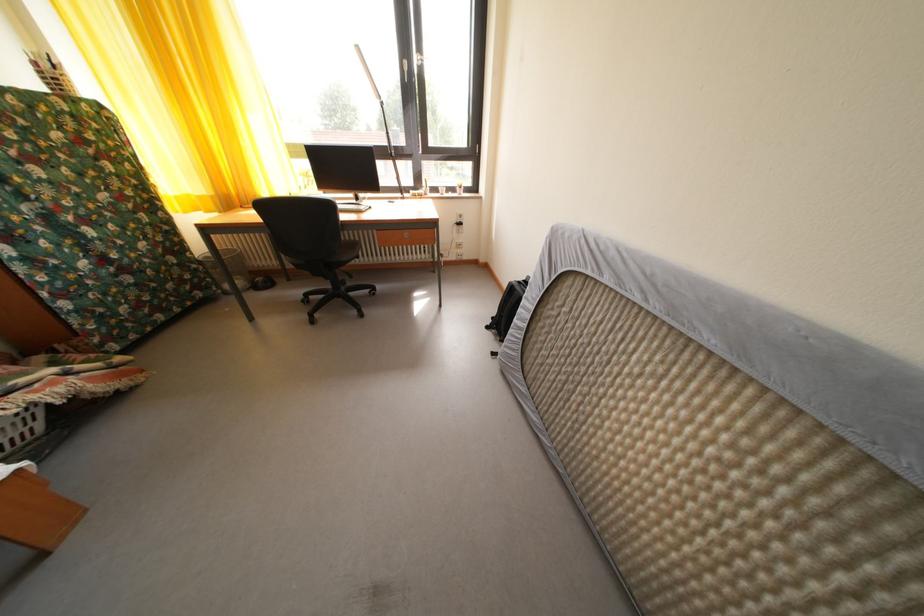
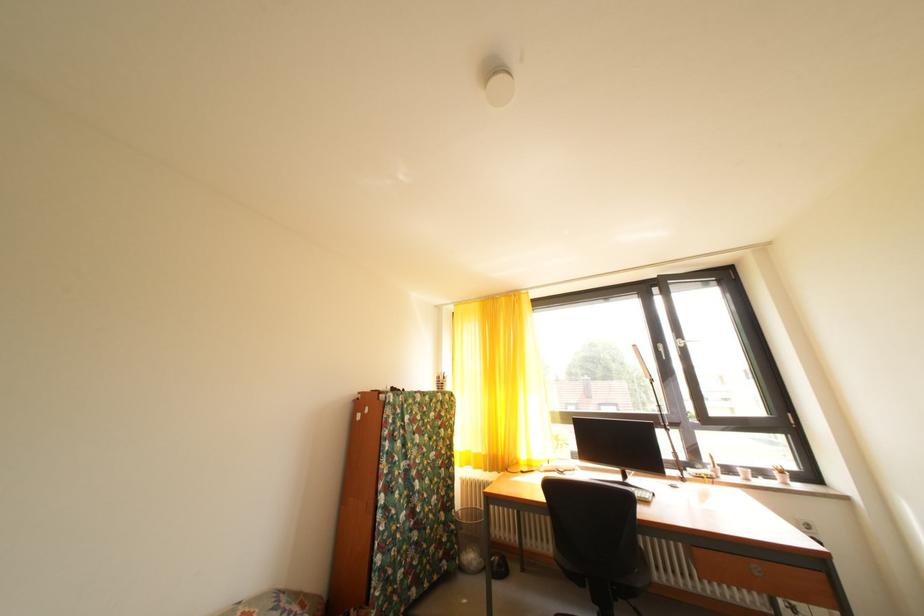
Find the pixel in the second image that matches point 203,273 in the first image.

(462, 533)